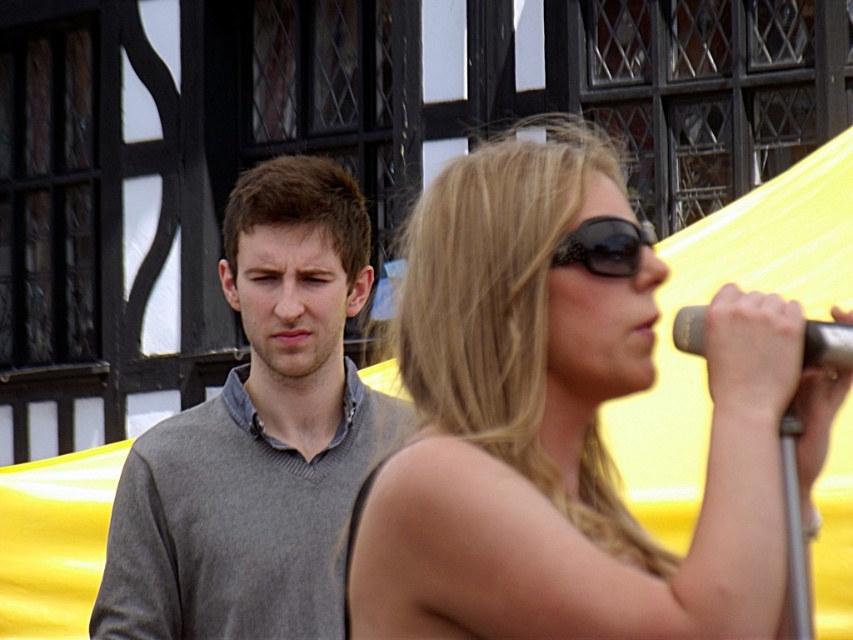
Which of these two, gray wool sweater at left or black reflective sunglasses at upper right, stands taller?

Standing taller between the two is gray wool sweater at left.

Can you confirm if gray wool sweater at left is bigger than black reflective sunglasses at upper right?

Yes, gray wool sweater at left is bigger than black reflective sunglasses at upper right.

Between point (315, 481) and point (590, 253), which one is positioned in front?

Point (590, 253)

Identify the location of gray wool sweater at left. Image resolution: width=853 pixels, height=640 pixels. (259, 435).

Is black reflective sunglasses at upper right taller than metallic silver microphone at right?

Yes.

Between black reflective sunglasses at upper right and metallic silver microphone at right, which one is positioned lower?

Positioned lower is metallic silver microphone at right.

I want to click on black reflective sunglasses at upper right, so click(605, 244).

Based on the photo, is shiny black sunglasses at center closer to the viewer compared to black reflective sunglasses at upper right?

Yes.

Which of these two, shiny black sunglasses at center or black reflective sunglasses at upper right, stands taller?

black reflective sunglasses at upper right is taller.

Find the location of a particular element. This screenshot has width=853, height=640. shiny black sunglasses at center is located at coordinates (564, 428).